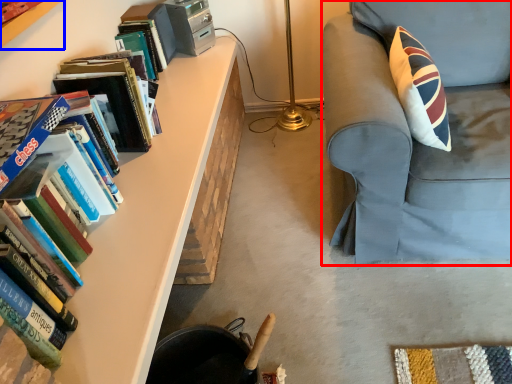
Question: Among these objects, which one is nearest to the camera, chair (highlighted by a red box) or bookcase (highlighted by a blue box)?

Choices:
 (A) chair
 (B) bookcase

Answer: (B)